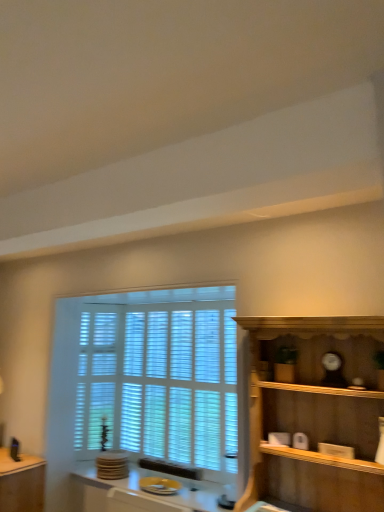
Question: Is there a large distance between white wood window at center and yellow glossy plate at lower center?

Choices:
 (A) no
 (B) yes

Answer: (A)

Question: Does white wood window at center have a smaller size compared to yellow glossy plate at lower center?

Choices:
 (A) yes
 (B) no

Answer: (B)

Question: Is white wood window at center shorter than yellow glossy plate at lower center?

Choices:
 (A) yes
 (B) no

Answer: (B)

Question: Does white wood window at center have a greater width compared to yellow glossy plate at lower center?

Choices:
 (A) yes
 (B) no

Answer: (B)

Question: Would you say white wood window at center contains yellow glossy plate at lower center?

Choices:
 (A) no
 (B) yes

Answer: (A)

Question: From a real-world perspective, is white wood window at center below yellow glossy plate at lower center?

Choices:
 (A) yes
 (B) no

Answer: (B)

Question: Can you confirm if yellow glossy plate at lower center is shorter than matte brown table at lower left?

Choices:
 (A) yes
 (B) no

Answer: (A)

Question: Is yellow glossy plate at lower center placed right next to matte brown table at lower left?

Choices:
 (A) yes
 (B) no

Answer: (B)

Question: From a real-world perspective, is yellow glossy plate at lower center on matte brown table at lower left?

Choices:
 (A) no
 (B) yes

Answer: (B)

Question: Is the depth of yellow glossy plate at lower center greater than that of matte brown table at lower left?

Choices:
 (A) yes
 (B) no

Answer: (B)

Question: Considering the relative sizes of yellow glossy plate at lower center and matte brown table at lower left in the image provided, is yellow glossy plate at lower center thinner than matte brown table at lower left?

Choices:
 (A) no
 (B) yes

Answer: (A)

Question: Is matte brown table at lower left inside yellow glossy plate at lower center?

Choices:
 (A) no
 (B) yes

Answer: (A)

Question: From the image's perspective, is white wood window at center located beneath wooden shelf at right?

Choices:
 (A) no
 (B) yes

Answer: (B)